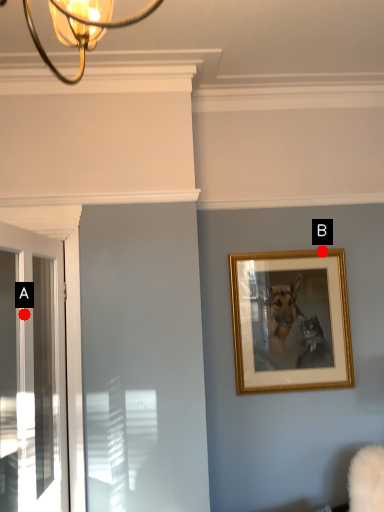
Question: Two points are circled on the image, labeled by A and B beside each circle. Which point is closer to the camera taking this photo?

Choices:
 (A) A is closer
 (B) B is closer

Answer: (A)